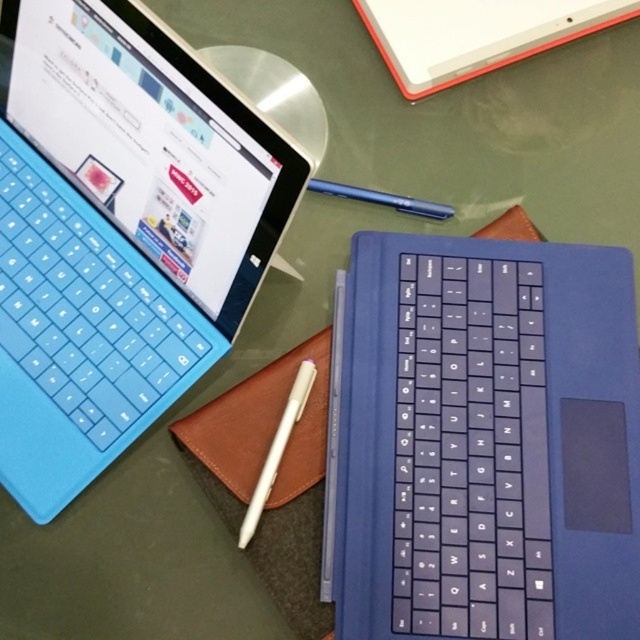
Question: Which object is closer to the camera taking this photo?

Choices:
 (A) blue rubberized keyboard at upper left
 (B) blue metallic pen at upper center
 (C) slate matte keyboard at center
 (D) white matte laptop at upper center

Answer: (A)

Question: Does leather notepad at center have a larger size compared to blue metallic pen at upper center?

Choices:
 (A) no
 (B) yes

Answer: (B)

Question: Which of the following is the farthest from the observer?

Choices:
 (A) (396, 195)
 (B) (230, 465)
 (C) (531, 365)

Answer: (A)

Question: Is slate matte keyboard at center smaller than leather notepad at center?

Choices:
 (A) yes
 (B) no

Answer: (B)

Question: Estimate the real-world distances between objects in this image. Which object is closer to the slate matte keyboard at center?

Choices:
 (A) white matte laptop at upper center
 (B) blue metallic pen at upper center
 (C) leather notepad at center
 (D) blue rubberized keyboard at upper left

Answer: (C)

Question: Can you confirm if slate matte keyboard at center is positioned to the left of leather notepad at center?

Choices:
 (A) yes
 (B) no

Answer: (B)